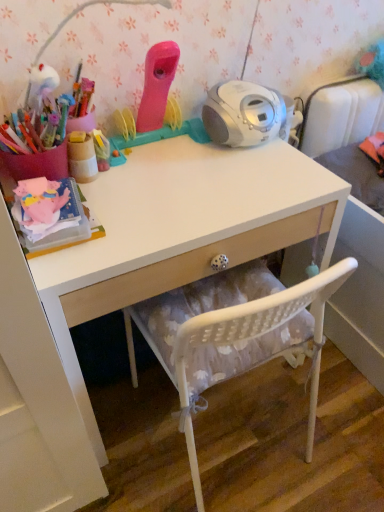
At what (x,y) coordinates should I click in order to perform the action: click on empty space that is ontop of white mesh chair at lower center. Please return your answer as a coordinate pair (x, y). Looking at the image, I should click on (251, 438).